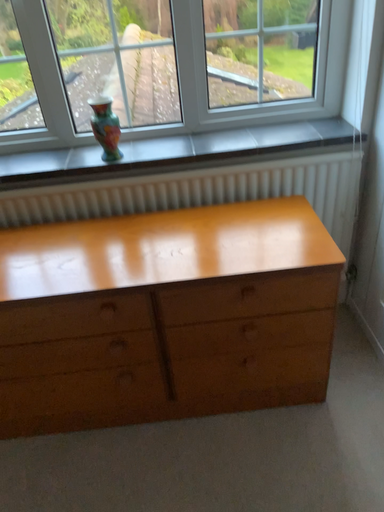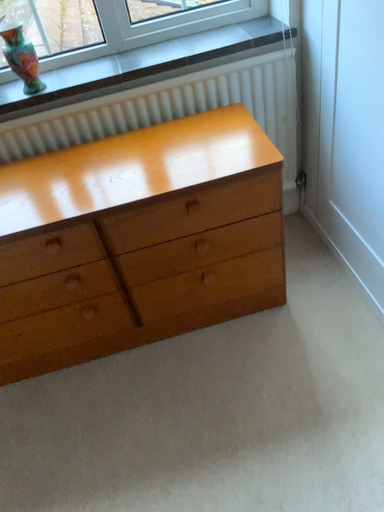
Question: Which way did the camera rotate in the video?

Choices:
 (A) rotated downward
 (B) rotated upward

Answer: (A)